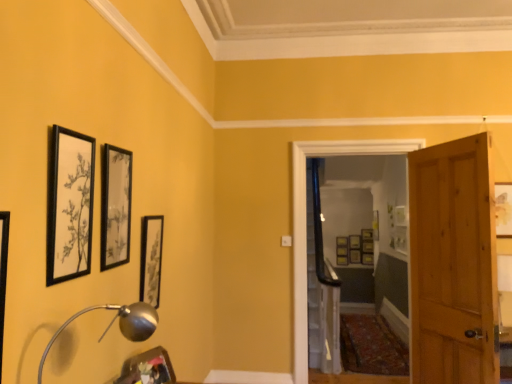
Question: Considering the relative sizes of silver metallic table lamp at lower left and wooden picture frame at center, which is counted as the twelfth picture frame, starting from the front, in the image provided, is silver metallic table lamp at lower left taller than wooden picture frame at center, which is counted as the twelfth picture frame, starting from the front,?

Choices:
 (A) no
 (B) yes

Answer: (B)

Question: Are silver metallic table lamp at lower left and wooden picture frame at center, the third picture frame viewed from the back, located far from each other?

Choices:
 (A) yes
 (B) no

Answer: (A)

Question: Is silver metallic table lamp at lower left oriented away from wooden picture frame at center, which is counted as the twelfth picture frame, starting from the front?

Choices:
 (A) no
 (B) yes

Answer: (A)

Question: Is silver metallic table lamp at lower left further to camera compared to wooden picture frame at center, the third picture frame viewed from the back?

Choices:
 (A) yes
 (B) no

Answer: (B)

Question: Is wooden picture frame at center, the 6th picture frame viewed from the left, completely or partially inside silver metallic table lamp at lower left?

Choices:
 (A) yes
 (B) no

Answer: (B)

Question: Choose the correct answer: Is matte gold picture frame at center, which appears as the 8th picture frame when viewed from the left, inside matte black picture frame at upper center, the twelfth picture frame in the back-to-front sequence, or outside it?

Choices:
 (A) inside
 (B) outside

Answer: (B)

Question: Considering the relative positions of matte gold picture frame at center, which appears as the 8th picture frame when viewed from the left, and matte black picture frame at upper center, the 3th picture frame positioned from the left, in the image provided, is matte gold picture frame at center, which appears as the 8th picture frame when viewed from the left, to the left or to the right of matte black picture frame at upper center, the 3th picture frame positioned from the left,?

Choices:
 (A) left
 (B) right

Answer: (B)

Question: From the image's perspective, relative to matte black picture frame at upper center, the third picture frame from the front, is matte gold picture frame at center, which appears as the 8th picture frame when viewed from the left, above or below?

Choices:
 (A) above
 (B) below

Answer: (B)

Question: Considering the positions of matte gold picture frame at center, the first picture frame from the back, and matte black picture frame at upper center, the third picture frame from the front, in the image, is matte gold picture frame at center, the first picture frame from the back, taller or shorter than matte black picture frame at upper center, the third picture frame from the front,?

Choices:
 (A) tall
 (B) short

Answer: (B)

Question: From the image's perspective, is silver metallic table lamp at lower left positioned above or below wooden picture frame at center, acting as the thirteenth picture frame starting from the left?

Choices:
 (A) above
 (B) below

Answer: (A)

Question: Is silver metallic table lamp at lower left to the left or to the right of wooden picture frame at center, acting as the thirteenth picture frame starting from the left, in the image?

Choices:
 (A) right
 (B) left

Answer: (B)

Question: Relative to wooden picture frame at center, acting as the thirteenth picture frame starting from the left, is silver metallic table lamp at lower left in front or behind?

Choices:
 (A) front
 (B) behind

Answer: (A)

Question: In terms of size, does silver metallic table lamp at lower left appear bigger or smaller than wooden picture frame at center, the 8th picture frame in the front-to-back sequence?

Choices:
 (A) big
 (B) small

Answer: (A)

Question: Considering the positions of matte black picture frame at center, which ranks as the fourth picture frame in right-to-left order, and wooden picture frame at center, the 8th picture frame in the front-to-back sequence, in the image, is matte black picture frame at center, which ranks as the fourth picture frame in right-to-left order, taller or shorter than wooden picture frame at center, the 8th picture frame in the front-to-back sequence,?

Choices:
 (A) tall
 (B) short

Answer: (A)

Question: Considering the positions of matte black picture frame at center, which ranks as the fourth picture frame in right-to-left order, and wooden picture frame at center, the 7th picture frame viewed from the back, in the image, is matte black picture frame at center, which ranks as the fourth picture frame in right-to-left order, wider or thinner than wooden picture frame at center, the 7th picture frame viewed from the back,?

Choices:
 (A) thin
 (B) wide

Answer: (A)